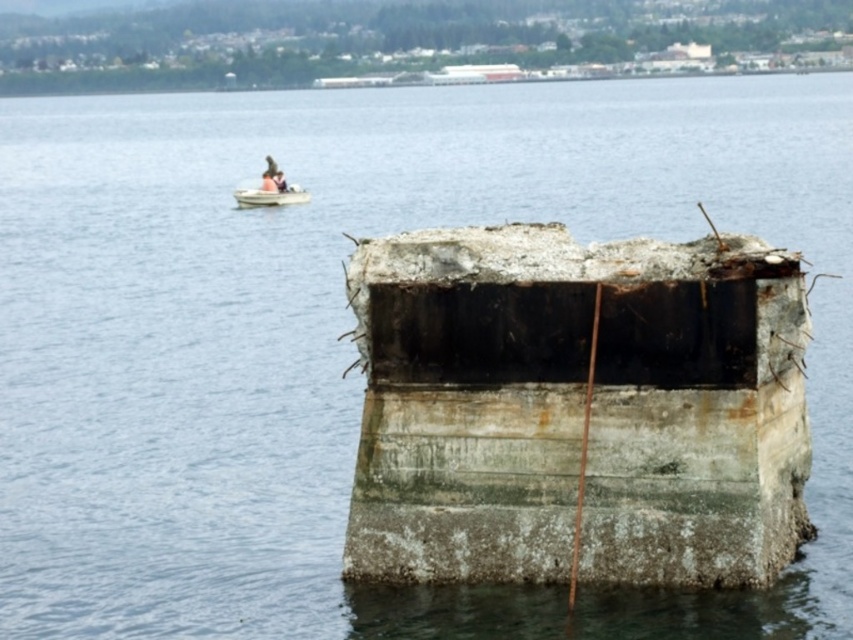
Question: Is rusty concrete dock at center positioned in front of white plastic boat at upper left?

Choices:
 (A) no
 (B) yes

Answer: (B)

Question: Which object is farther from the camera taking this photo?

Choices:
 (A) white plastic boat at upper left
 (B) light brown wooden boat at upper left

Answer: (B)

Question: Can you confirm if rusty concrete dock at center is bigger than white plastic boat at upper left?

Choices:
 (A) no
 (B) yes

Answer: (B)

Question: Which object appears farthest from the camera in this image?

Choices:
 (A) white plastic boat at upper left
 (B) rusty concrete dock at center
 (C) light brown wooden boat at upper left

Answer: (C)

Question: Among these points, which one is farthest from the camera?

Choices:
 (A) (276, 189)
 (B) (268, 189)
 (C) (738, 493)

Answer: (B)

Question: Is rusty concrete dock at center bigger than light brown wooden boat at upper left?

Choices:
 (A) yes
 (B) no

Answer: (A)